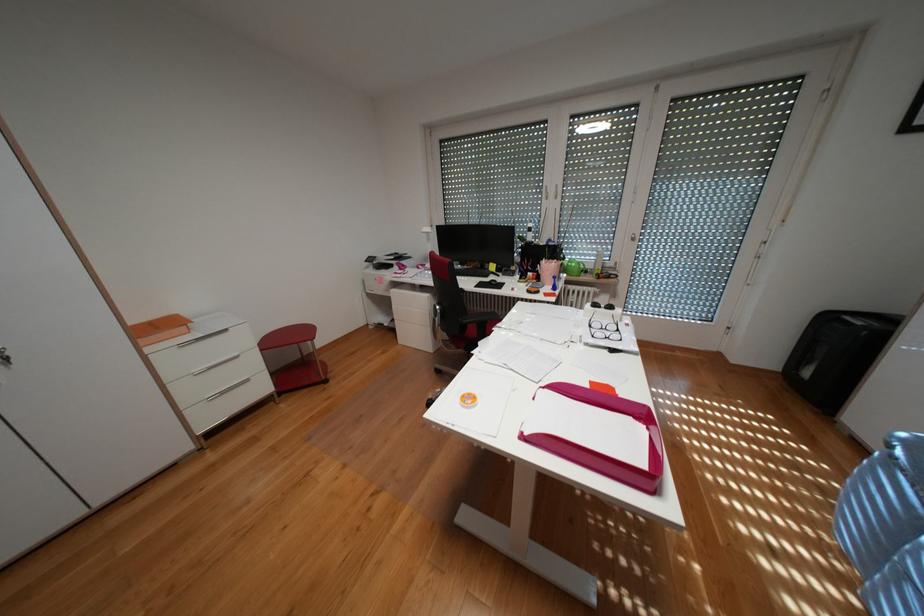
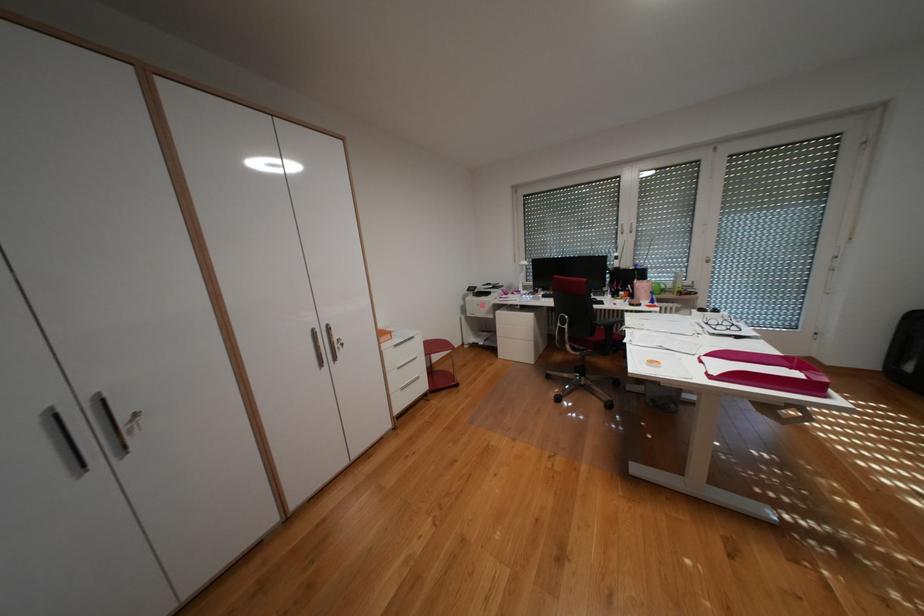
Where in the second image is the point corresponding to point 178,379 from the first image?

(399, 370)